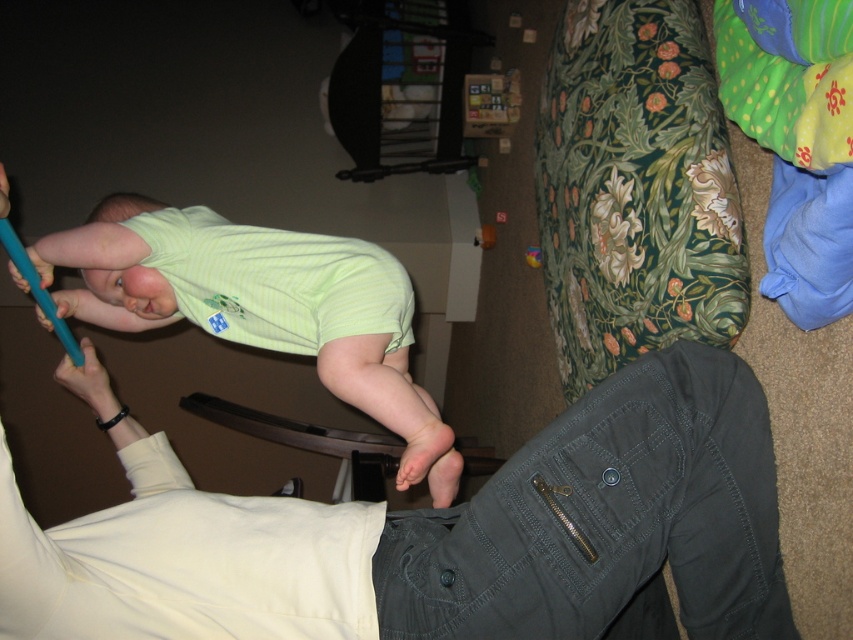
You are a parent trying to place a small toy on the light green fabric at upper left and the blue rubber finger at upper left. Which surface can the toy be placed on without falling off?

The light green fabric at upper left is much taller than the blue rubber finger at upper left, so the toy can be placed on the light green fabric at upper left without falling off.

You are a photographer trying to capture a candid shot of the baby and the adult. You notice the light green fabric at upper left and the blue rubber finger at upper left in the frame. Which object should you adjust to avoid blocking the other in your photo?

You should adjust the blue rubber finger at upper left because it is behind the light green fabric at upper left, so moving it would prevent it from being obscured by the fabric.